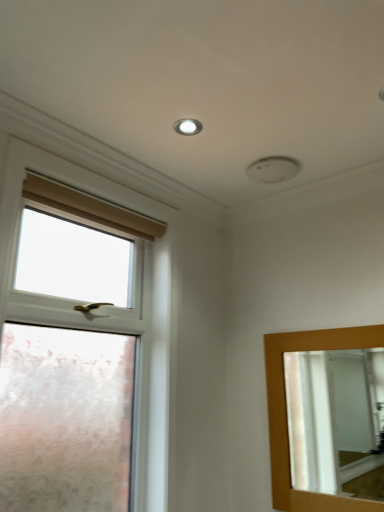
Describe the element at coordinates (334, 417) in the screenshot. I see `wooden-framed mirror at right` at that location.

The height and width of the screenshot is (512, 384). In order to click on white frosted glass window at left in this screenshot , I will do `click(75, 365)`.

Locate an element on the screen. matte white droplight at upper center is located at coordinates (187, 127).

The width and height of the screenshot is (384, 512). I want to click on mirror on the right side of matte white droplight at upper center, so click(334, 417).

Who is smaller, matte white droplight at upper center or wooden-framed mirror at right?

Smaller between the two is matte white droplight at upper center.

From a real-world perspective, which object stands above the other?

matte white droplight at upper center.

Is matte white droplight at upper center located outside wooden-framed mirror at right?

Yes, matte white droplight at upper center is not within wooden-framed mirror at right.

From the image's perspective, does matte white droplight at upper center appear higher than white frosted glass window at left?

Yes, from the image's perspective, matte white droplight at upper center is on top of white frosted glass window at left.

Is matte white droplight at upper center not within white frosted glass window at left?

Yes, matte white droplight at upper center is located beyond the bounds of white frosted glass window at left.

Find the location of a particular element. The width and height of the screenshot is (384, 512). droplight above the white frosted glass window at left (from a real-world perspective) is located at coordinates (187, 127).

Which is more to the right, matte white droplight at upper center or white frosted glass window at left?

matte white droplight at upper center.

From the image's perspective, is white frosted glass window at left located beneath matte white droplight at upper center?

Correct, white frosted glass window at left appears lower than matte white droplight at upper center in the image.

Does white frosted glass window at left contain matte white droplight at upper center?

That's incorrect, matte white droplight at upper center is not inside white frosted glass window at left.

Is point (20, 214) closer or farther from the camera than point (183, 125)?

Point (20, 214) is closer to the camera than point (183, 125).

Which object is wider, white frosted glass window at left or wooden-framed mirror at right?

Wider between the two is white frosted glass window at left.

Who is more distant, white frosted glass window at left or wooden-framed mirror at right?

wooden-framed mirror at right.

Measure the distance between white frosted glass window at left and wooden-framed mirror at right.

white frosted glass window at left and wooden-framed mirror at right are 1.47 meters apart.

Which is more to the left, white frosted glass window at left or wooden-framed mirror at right?

white frosted glass window at left is more to the left.

Which is in front, point (364, 397) or point (139, 322)?

Point (139, 322)

Is wooden-framed mirror at right outside of white frosted glass window at left?

Yes, wooden-framed mirror at right is not within white frosted glass window at left.

Is wooden-framed mirror at right positioned with its back to white frosted glass window at left?

wooden-framed mirror at right is not turned away from white frosted glass window at left.

Identify the location of window above the wooden-framed mirror at right (from the image's perspective). (75, 365).

Visually, is wooden-framed mirror at right positioned to the left or to the right of matte white droplight at upper center?

From the image, it's evident that wooden-framed mirror at right is to the right of matte white droplight at upper center.

Is wooden-framed mirror at right positioned with its back to matte white droplight at upper center?

That's not correct — wooden-framed mirror at right is not looking away from matte white droplight at upper center.

The width and height of the screenshot is (384, 512). I want to click on droplight behind the wooden-framed mirror at right, so click(187, 127).

What are the coordinates of `droplight above the white frosted glass window at left (from a real-world perspective)` in the screenshot? It's located at (187, 127).

Looking at this image, when comparing their distances from white frosted glass window at left, does wooden-framed mirror at right or matte white droplight at upper center seem closer?

matte white droplight at upper center.

Based on their spatial positions, is white frosted glass window at left or matte white droplight at upper center further from wooden-framed mirror at right?

matte white droplight at upper center lies further to wooden-framed mirror at right than the other object.

Which object lies nearer to the anchor point wooden-framed mirror at right, matte white droplight at upper center or white frosted glass window at left?

Among the two, white frosted glass window at left is located nearer to wooden-framed mirror at right.

From the image, which object appears to be nearer to matte white droplight at upper center, wooden-framed mirror at right or white frosted glass window at left?

white frosted glass window at left.

Looking at the image, which one is located closer to white frosted glass window at left, matte white droplight at upper center or wooden-framed mirror at right?

Among the two, matte white droplight at upper center is located nearer to white frosted glass window at left.

Looking at the image, which one is located closer to matte white droplight at upper center, white frosted glass window at left or wooden-framed mirror at right?

white frosted glass window at left is positioned closer to the anchor matte white droplight at upper center.

Where is `window between matte white droplight at upper center and wooden-framed mirror at right in the vertical direction`? The height and width of the screenshot is (512, 384). window between matte white droplight at upper center and wooden-framed mirror at right in the vertical direction is located at coordinates (75, 365).